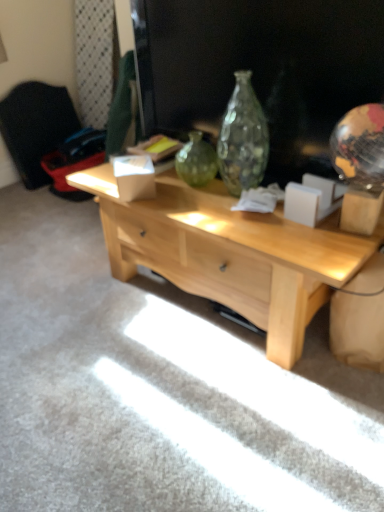
Question: Looking at their shapes, would you say light wood desk at center is wider or thinner than black fabric armchair at left?

Choices:
 (A) wide
 (B) thin

Answer: (A)

Question: Is light wood desk at center situated inside black fabric armchair at left or outside?

Choices:
 (A) inside
 (B) outside

Answer: (B)

Question: Is light wood desk at center to the left or to the right of black fabric armchair at left in the image?

Choices:
 (A) right
 (B) left

Answer: (A)

Question: Is black fabric armchair at left in front of or behind light wood desk at center in the image?

Choices:
 (A) behind
 (B) front

Answer: (A)

Question: Is black fabric armchair at left taller or shorter than light wood desk at center?

Choices:
 (A) short
 (B) tall

Answer: (B)

Question: Is black fabric armchair at left spatially inside light wood desk at center, or outside of it?

Choices:
 (A) outside
 (B) inside

Answer: (A)

Question: Looking at the image, does black fabric armchair at left seem bigger or smaller compared to light wood desk at center?

Choices:
 (A) big
 (B) small

Answer: (B)